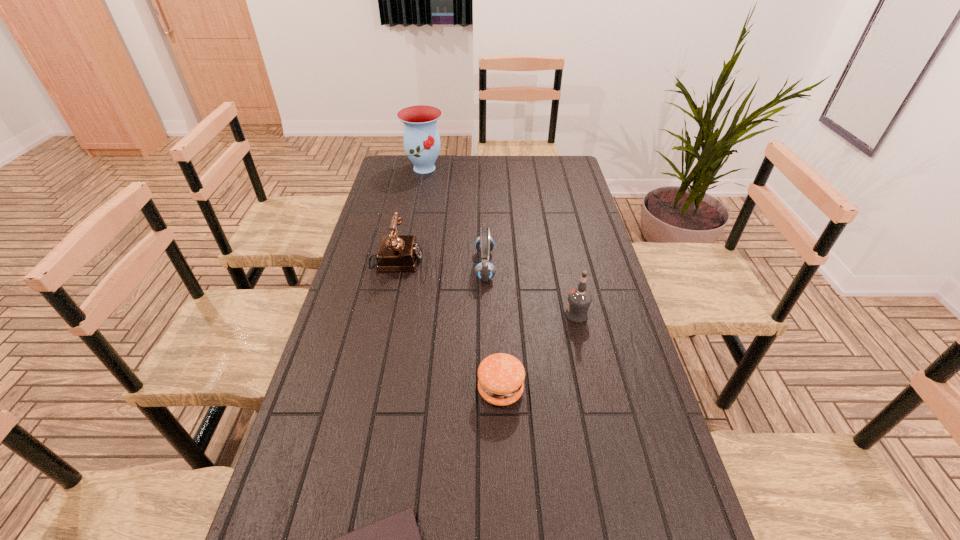
I want to click on vacant space located 0.100m on the front label of the vodka, so click(x=532, y=315).

What are the coordinates of `vacant area located on the front label of the vodka` in the screenshot? It's located at (445, 315).

Locate an element on the screen. vacant area located on the dial of the telephone is located at coordinates (437, 262).

Where is `free location located 0.190m on the ear cups of the headset`? free location located 0.190m on the ear cups of the headset is located at coordinates (420, 266).

Where is `free space located on the ear cups of the headset`? free space located on the ear cups of the headset is located at coordinates (357, 266).

Where is `vacant space located on the ear cups of the headset`? vacant space located on the ear cups of the headset is located at coordinates (396, 266).

Where is `vacant point located 0.120m on the back of the patty`? The width and height of the screenshot is (960, 540). vacant point located 0.120m on the back of the patty is located at coordinates (498, 336).

Identify the location of object at the far edge. (421, 139).

Where is `vase that is at the left edge`? The height and width of the screenshot is (540, 960). vase that is at the left edge is located at coordinates (421, 139).

You are a GUI agent. You are given a task and a screenshot of the screen. Output one action in this format:
    pyautogui.click(x=<x>, y=<y>)
    Task: Click on the telephone that is at the left edge
    
    Given the screenshot: What is the action you would take?
    pyautogui.click(x=401, y=253)